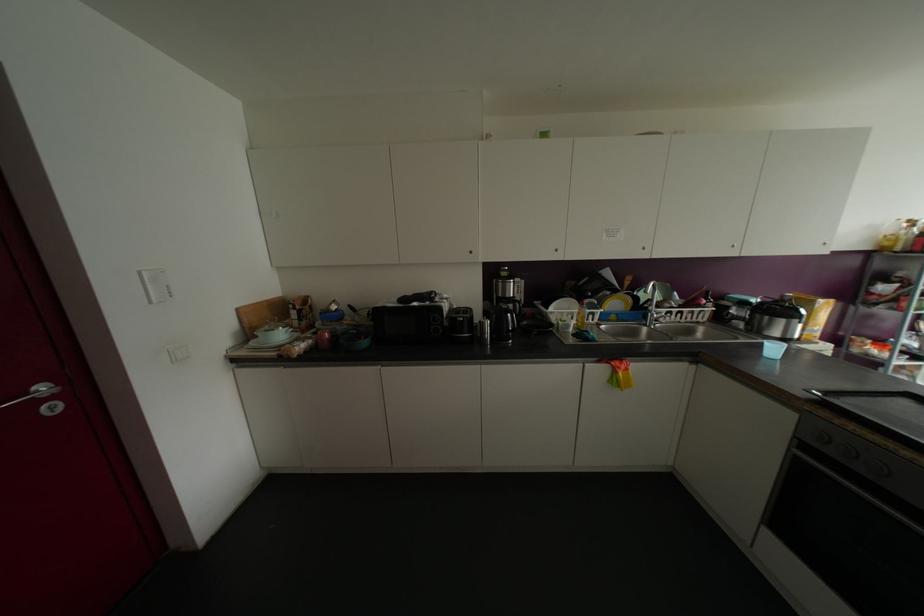
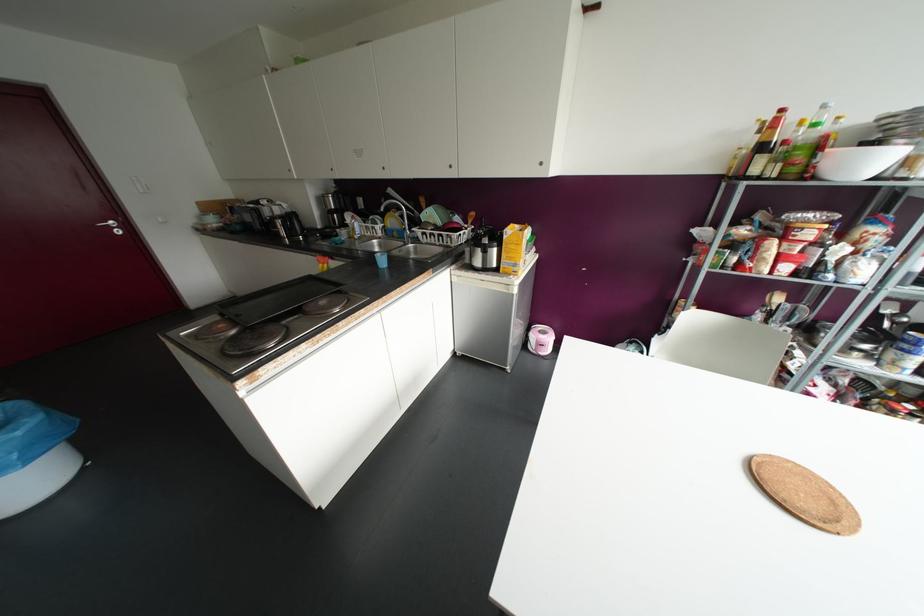
Find the pixel in the second image that matches point (53, 408) in the first image.

(117, 232)